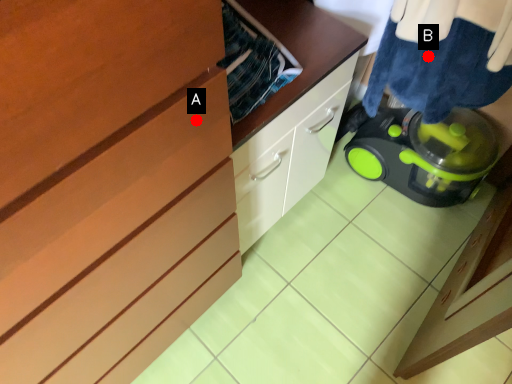
Question: Two points are circled on the image, labeled by A and B beside each circle. Which point is farther to the camera?

Choices:
 (A) A is further
 (B) B is further

Answer: (B)